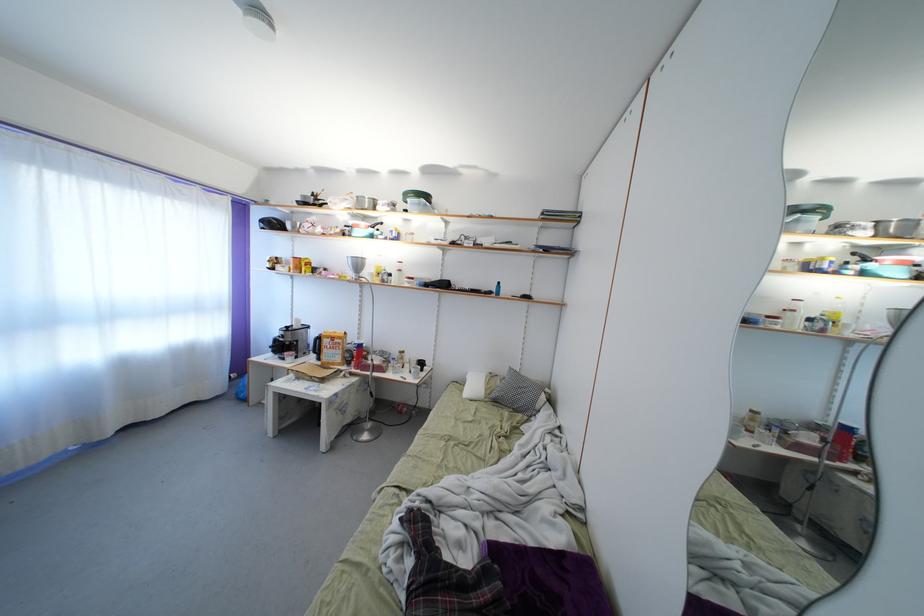
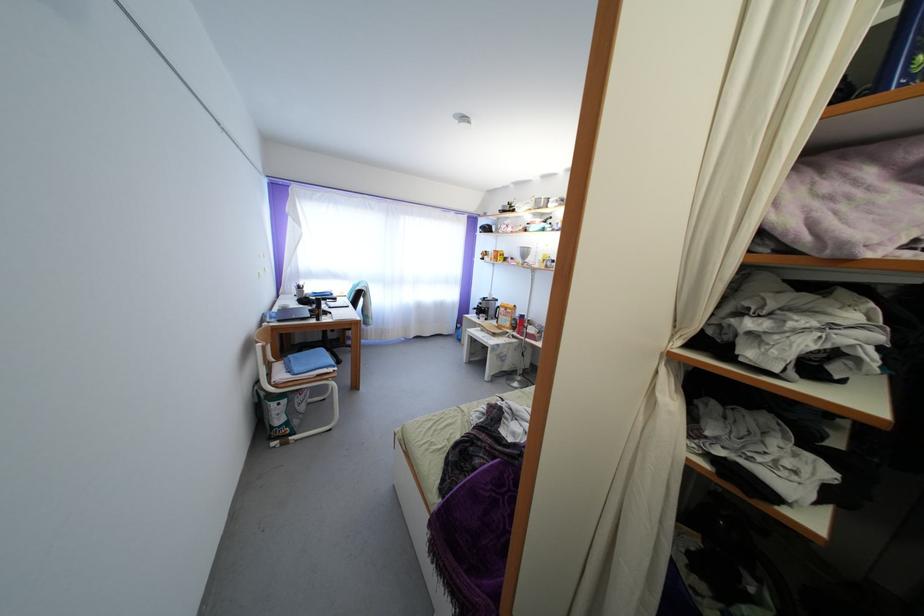
Question: The camera is either moving clockwise (left) or counter-clockwise (right) around the object. The first image is from the beginning of the video and the second image is from the end. Is the camera moving left or right when shooting the video?

Choices:
 (A) Left
 (B) Right

Answer: (B)